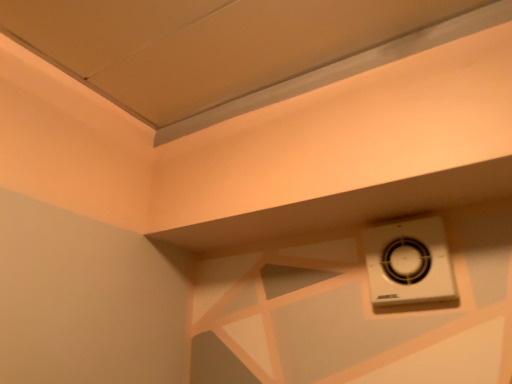
The height and width of the screenshot is (384, 512). In order to click on white plastic air vent at upper right in this screenshot , I will do tap(409, 263).

What do you see at coordinates (409, 263) in the screenshot? This screenshot has width=512, height=384. I see `white plastic air vent at upper right` at bounding box center [409, 263].

What is the approximate height of white plastic air vent at upper right?

white plastic air vent at upper right is 6.71 inches tall.

Measure the distance between white plastic air vent at upper right and camera.

They are 31.25 inches apart.

Identify the location of white plastic air vent at upper right. (409, 263).